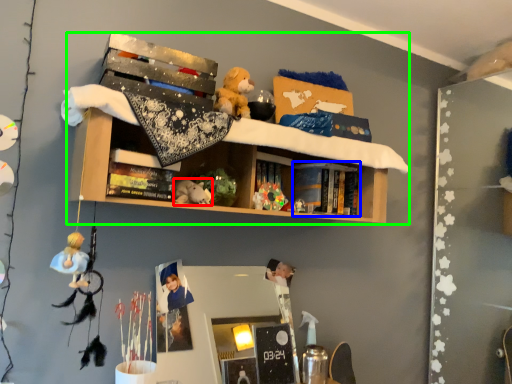
Question: Based on their relative distances, which object is nearer to toy (highlighted by a red box)? Choose from book (highlighted by a blue box) and shelf (highlighted by a green box).

Choices:
 (A) book
 (B) shelf

Answer: (B)